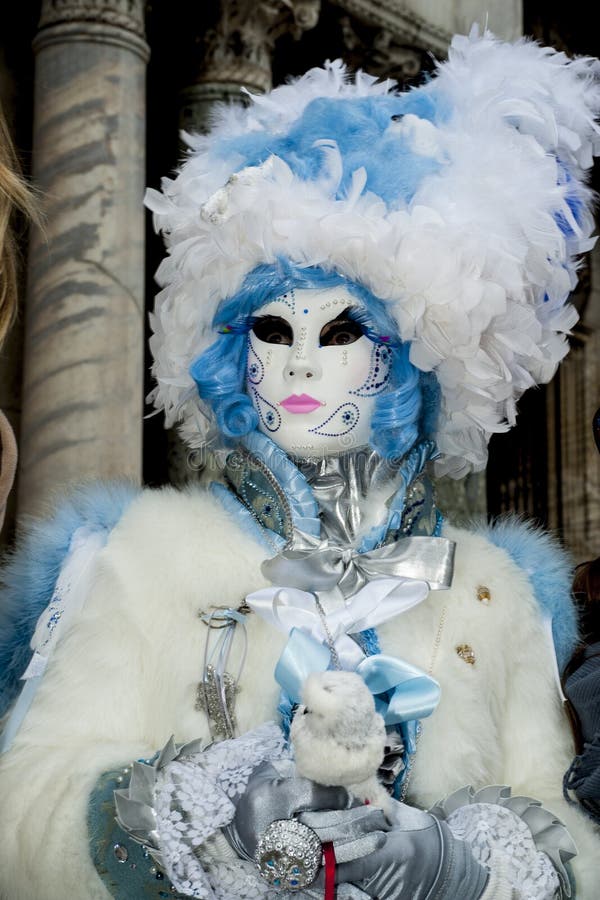
Find the location of a particular element. space between pillars is located at coordinates (163, 104).